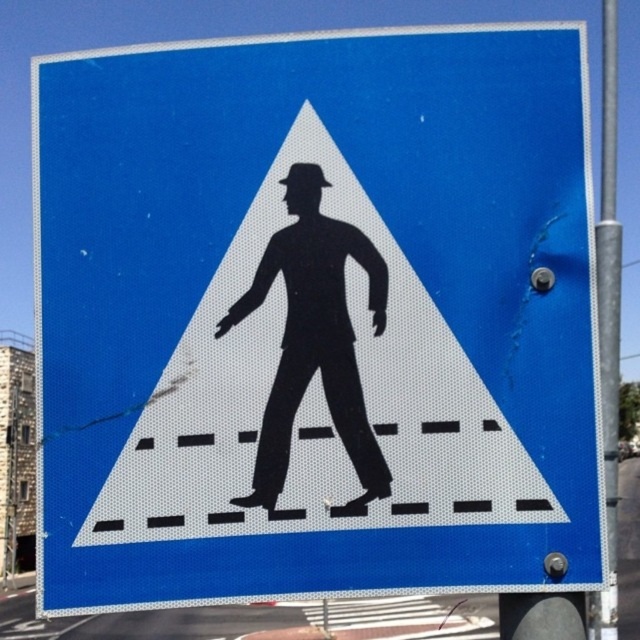
Can you confirm if black matte figure at center is positioned above metallic gray pole at right?

No.

The width and height of the screenshot is (640, 640). Describe the element at coordinates (314, 339) in the screenshot. I see `black matte figure at center` at that location.

Is point (301, 360) positioned in front of point (616, 604)?

Yes, point (301, 360) is in front of point (616, 604).

The height and width of the screenshot is (640, 640). Identify the location of black matte figure at center. (314, 339).